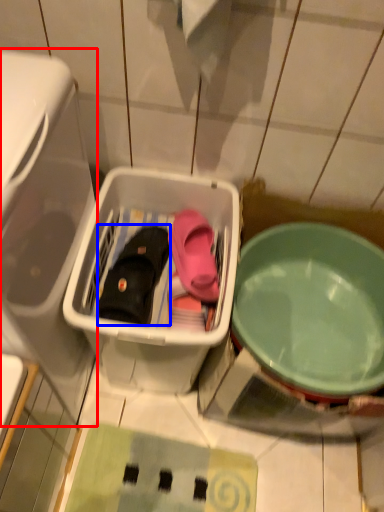
Question: Which point is further to the camera, dish washer (highlighted by a red box) or footwear (highlighted by a blue box)?

Choices:
 (A) dish washer
 (B) footwear

Answer: (B)